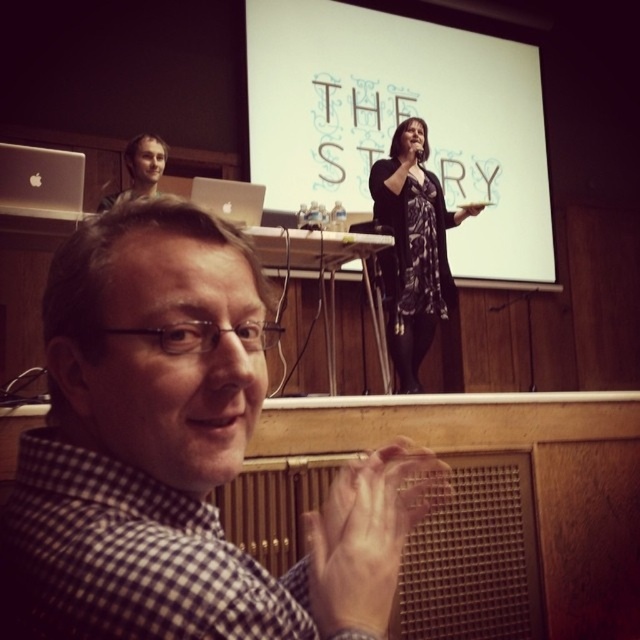
You are an attendee at this presentation. You notice both the white matte projection screen at upper center and the matte silver laptop at upper center. Which object is larger in size?

The white matte projection screen at upper center is bigger than the matte silver laptop at upper center.

You are standing in the presentation room and want to move from point A to point B. Point A is at coordinate point (515, 140) and point B is at coordinate point (253, 195). Which point is closer to you?

Point B at coordinate point (253, 195) is closer to you because it is nearer to the camera compared to point A at coordinate point (515, 140).

You are standing in the front row of the presentation. The speaker is at the podium. Where is the white checkered shirt at center located relative to you?

The white checkered shirt at center is located at point (179, 452) relative to you.